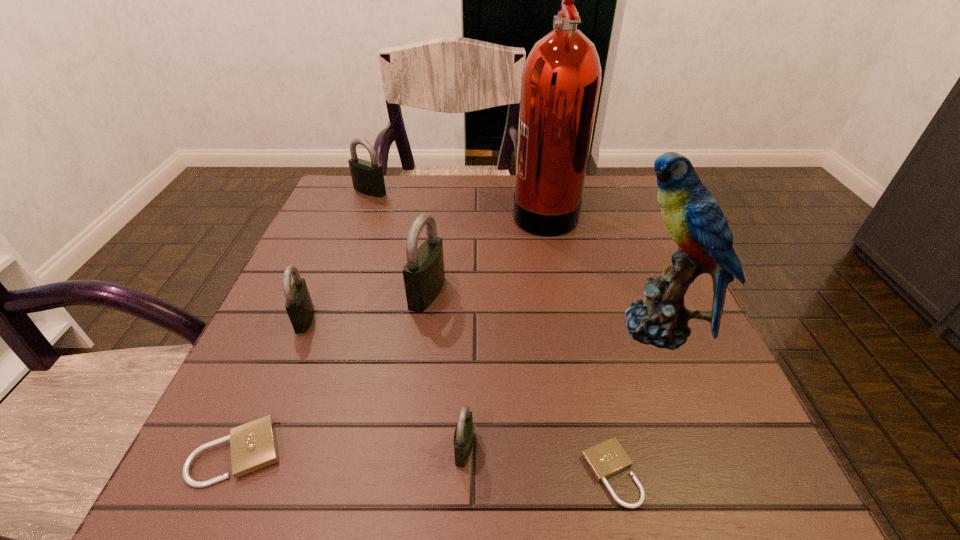
At what (x,y) coordinates should I click in order to perform the action: click on free space at the far right corner of the desktop. Please return your answer as a coordinate pair (x, y). The height and width of the screenshot is (540, 960). Looking at the image, I should click on point(596,190).

This screenshot has height=540, width=960. Find the location of `free space between the right beige padlock and the fifth tallest padlock`. free space between the right beige padlock and the fifth tallest padlock is located at coordinates (425, 463).

The width and height of the screenshot is (960, 540). What are the coordinates of `vacant area that lies between the shortest object and the fourth shortest padlock` in the screenshot? It's located at (458, 396).

Where is `vacant area that lies between the second tallest padlock and the rightmost object`? The width and height of the screenshot is (960, 540). vacant area that lies between the second tallest padlock and the rightmost object is located at coordinates (514, 259).

Identify the location of blank region between the second black padlock from right to left and the shortest object. (519, 383).

At what (x,y) coordinates should I click in order to perform the action: click on vacant space that's between the tallest object and the bigger beige padlock. Please return your answer as a coordinate pair (x, y). Looking at the image, I should click on (392, 332).

Find the location of a particular element. The width and height of the screenshot is (960, 540). free point between the sixth tallest object and the fourth shortest padlock is located at coordinates (384, 383).

Locate an element on the screen. This screenshot has height=540, width=960. empty space that is in between the fourth object from right to left and the third smallest black padlock is located at coordinates (417, 320).

Find the location of `free space between the tallest object and the sixth tallest object`. free space between the tallest object and the sixth tallest object is located at coordinates (504, 329).

Where is `unoccupied position between the second shortest padlock and the smallest black padlock`? This screenshot has height=540, width=960. unoccupied position between the second shortest padlock and the smallest black padlock is located at coordinates (351, 450).